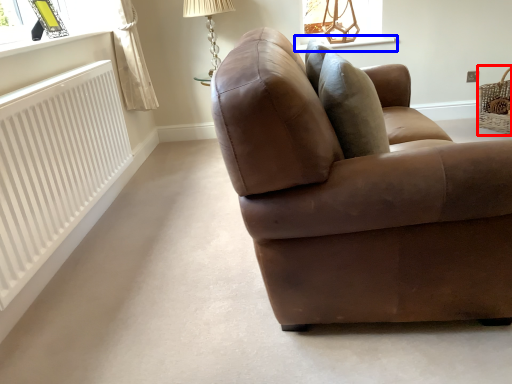
Question: Which object appears closest to the camera in this image, basket (highlighted by a red box) or window sill (highlighted by a blue box)?

Choices:
 (A) basket
 (B) window sill

Answer: (A)